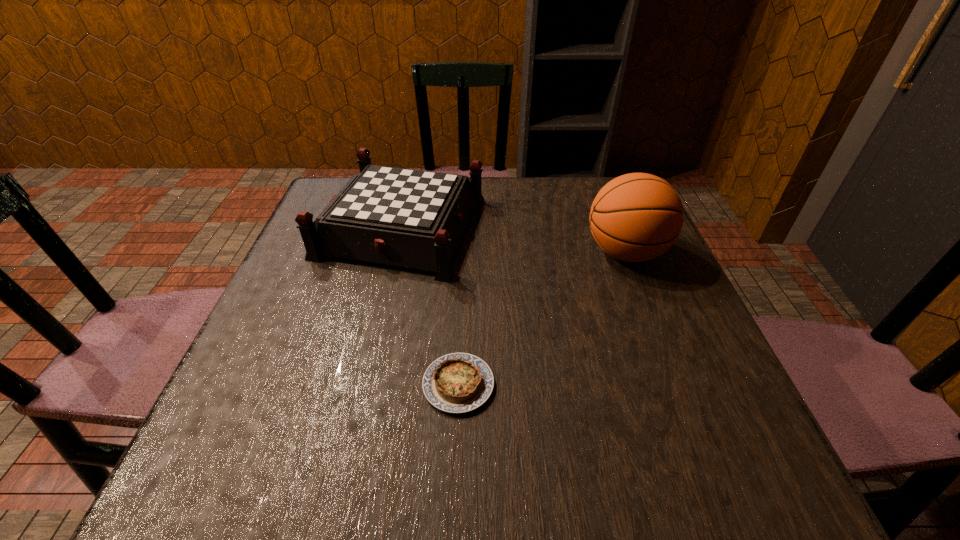
Where is `free space between the rightmost object and the quiche`? The height and width of the screenshot is (540, 960). free space between the rightmost object and the quiche is located at coordinates (542, 319).

Find the location of `free space between the second shortest object and the tallest object`. free space between the second shortest object and the tallest object is located at coordinates (514, 240).

Find the location of `vacant area that lies between the tallest object and the checkerboard`. vacant area that lies between the tallest object and the checkerboard is located at coordinates (514, 240).

Identify the location of vacant area that lies between the second shortest object and the rightmost object. (514, 240).

Locate an element on the screen. This screenshot has height=540, width=960. empty space that is in between the basketball and the second shortest object is located at coordinates (514, 240).

The width and height of the screenshot is (960, 540). I want to click on vacant region between the quiche and the second shortest object, so click(x=430, y=306).

Locate an element on the screen. The image size is (960, 540). unoccupied area between the quiche and the checkerboard is located at coordinates (430, 306).

Locate an element on the screen. Image resolution: width=960 pixels, height=540 pixels. empty location between the tallest object and the quiche is located at coordinates (542, 319).

Locate an element on the screen. object identified as the second closest to the checkerboard is located at coordinates (636, 217).

Locate an element on the screen. This screenshot has height=540, width=960. object that ranks as the second closest to the tallest object is located at coordinates (458, 382).